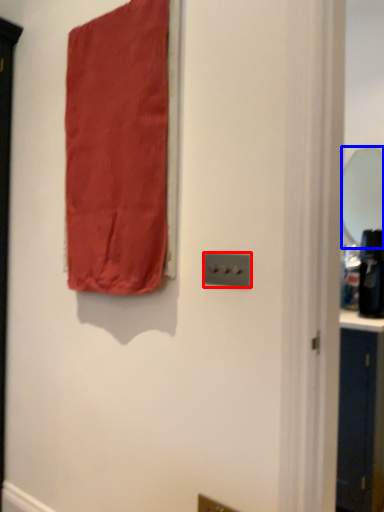
Question: Which point is closer to the camera, light switch (highlighted by a red box) or mirror (highlighted by a blue box)?

Choices:
 (A) light switch
 (B) mirror

Answer: (A)